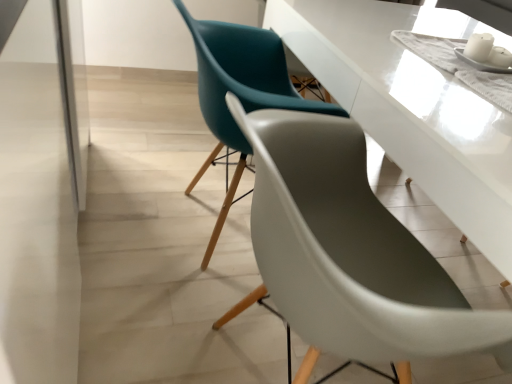
The image size is (512, 384). What do you see at coordinates (240, 90) in the screenshot? I see `matte teal chair at center, the second chair from the front` at bounding box center [240, 90].

Measure the distance between point (290, 95) and camera.

The distance of point (290, 95) from camera is 1.62 meters.

This screenshot has width=512, height=384. Find the location of `transparent glass door at left`. transparent glass door at left is located at coordinates (41, 188).

This screenshot has height=384, width=512. I want to click on glass door lying in front of the matte teal chair at center, acting as the 2th chair starting from the back, so click(x=41, y=188).

Is transparent glass door at left thinner than matte teal chair at center, acting as the 2th chair starting from the back?

Correct, the width of transparent glass door at left is less than that of matte teal chair at center, acting as the 2th chair starting from the back.

Considering the relative sizes of transparent glass door at left and matte teal chair at center, acting as the 2th chair starting from the back, in the image provided, is transparent glass door at left taller than matte teal chair at center, acting as the 2th chair starting from the back,?

Correct, transparent glass door at left is much taller as matte teal chair at center, acting as the 2th chair starting from the back.

Is transparent glass door at left positioned far away from matte teal chair at center, placed as the first chair when sorted from front to back?

No.

Is transparent glass door at left placed right next to matte teal chair at center, the second chair from the front?

transparent glass door at left is not next to matte teal chair at center, the second chair from the front, and they're not touching.

Looking at their sizes, would you say transparent glass door at left is wider or thinner than matte teal chair at center, the second chair from the front?

Clearly, transparent glass door at left has less width compared to matte teal chair at center, the second chair from the front.

Measure the distance between transparent glass door at left and matte teal chair at center, the second chair from the front.

transparent glass door at left is 18.80 inches away from matte teal chair at center, the second chair from the front.

I want to click on glass door in front of the matte teal chair at center, acting as the first chair starting from the back, so click(x=41, y=188).

From the picture: From a real-world perspective, is matte teal chair at center, the second chair from the front, positioned above or below matte teal chair at center, acting as the 2th chair starting from the back?

matte teal chair at center, the second chair from the front, is above matte teal chair at center, acting as the 2th chair starting from the back.

Is matte teal chair at center, the second chair from the front, turned away from matte teal chair at center, placed as the first chair when sorted from front to back?

matte teal chair at center, the second chair from the front, does not have its back to matte teal chair at center, placed as the first chair when sorted from front to back.

From the image's perspective, is matte teal chair at center, the second chair from the front, located above or below matte teal chair at center, placed as the first chair when sorted from front to back?

Clearly, from the image's perspective, matte teal chair at center, the second chair from the front, is above matte teal chair at center, placed as the first chair when sorted from front to back.

Is matte teal chair at center, acting as the first chair starting from the back, in front of or behind matte teal chair at center, placed as the first chair when sorted from front to back, in the image?

Visually, matte teal chair at center, acting as the first chair starting from the back, is located behind matte teal chair at center, placed as the first chair when sorted from front to back.

Considering the relative positions of matte teal chair at center, placed as the first chair when sorted from front to back, and transparent glass door at left in the image provided, is matte teal chair at center, placed as the first chair when sorted from front to back, to the right of transparent glass door at left from the viewer's perspective?

Yes.

Between matte teal chair at center, placed as the first chair when sorted from front to back, and transparent glass door at left, which one has more height?

transparent glass door at left is taller.

Identify the location of glass door on the left of matte teal chair at center, acting as the 2th chair starting from the back. (41, 188).

Does point (313, 232) appear closer or farther from the camera than point (56, 176)?

Point (313, 232) appears to be farther away from the viewer than point (56, 176).

Is matte teal chair at center, the second chair from the front, wider or thinner than transparent glass door at left?

matte teal chair at center, the second chair from the front, is wider than transparent glass door at left.

Considering the positions of objects matte teal chair at center, the second chair from the front, and transparent glass door at left in the image provided, who is more to the left, matte teal chair at center, the second chair from the front, or transparent glass door at left?

transparent glass door at left.

From the image's perspective, which is below, matte teal chair at center, acting as the 2th chair starting from the back, or matte teal chair at center, acting as the first chair starting from the back?

matte teal chair at center, acting as the 2th chair starting from the back.

How far apart are matte teal chair at center, placed as the first chair when sorted from front to back, and matte teal chair at center, acting as the first chair starting from the back?

matte teal chair at center, placed as the first chair when sorted from front to back, is 14.54 inches from matte teal chair at center, acting as the first chair starting from the back.

Identify the location of chair above the matte teal chair at center, placed as the first chair when sorted from front to back (from a real-world perspective). This screenshot has height=384, width=512. (240, 90).

Where is `chair that is the 2nd object to the right of the transparent glass door at left, starting at the anchor`? chair that is the 2nd object to the right of the transparent glass door at left, starting at the anchor is located at coordinates (349, 252).

I want to click on chair that is the 1st one below the transparent glass door at left (from a real-world perspective), so click(x=240, y=90).

Considering their positions, is matte teal chair at center, acting as the 2th chair starting from the back, positioned closer to matte teal chair at center, the second chair from the front, than transparent glass door at left?

matte teal chair at center, acting as the 2th chair starting from the back, is closer to matte teal chair at center, the second chair from the front.

Considering their positions, is matte teal chair at center, acting as the first chair starting from the back, positioned further to transparent glass door at left than matte teal chair at center, placed as the first chair when sorted from front to back?

The object further to transparent glass door at left is matte teal chair at center, placed as the first chair when sorted from front to back.

Considering their positions, is matte teal chair at center, acting as the first chair starting from the back, positioned closer to matte teal chair at center, acting as the 2th chair starting from the back, than transparent glass door at left?

Based on the image, matte teal chair at center, acting as the first chair starting from the back, appears to be nearer to matte teal chair at center, acting as the 2th chair starting from the back.

From the image, which object appears to be farther from transparent glass door at left, matte teal chair at center, acting as the 2th chair starting from the back, or matte teal chair at center, acting as the first chair starting from the back?

matte teal chair at center, acting as the 2th chair starting from the back, is positioned further to the anchor transparent glass door at left.

Looking at this image, when comparing their distances from matte teal chair at center, the second chair from the front, does transparent glass door at left or matte teal chair at center, acting as the 2th chair starting from the back, seem closer?

Based on the image, matte teal chair at center, acting as the 2th chair starting from the back, appears to be nearer to matte teal chair at center, the second chair from the front.

Looking at the image, which one is located closer to matte teal chair at center, placed as the first chair when sorted from front to back, transparent glass door at left or matte teal chair at center, the second chair from the front?

matte teal chair at center, the second chair from the front.

Locate an element on the screen. The height and width of the screenshot is (384, 512). chair between transparent glass door at left and matte teal chair at center, placed as the first chair when sorted from front to back, in the horizontal direction is located at coordinates (240, 90).